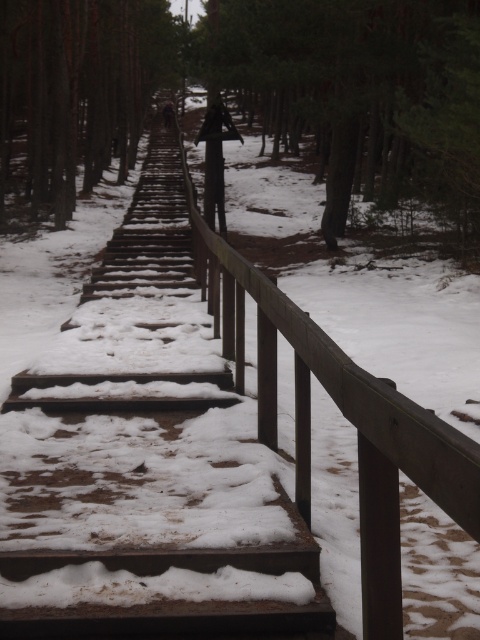
Question: Does wooden stairs at center have a greater width compared to brown wooden post at center?

Choices:
 (A) no
 (B) yes

Answer: (A)

Question: Does dark brown wood post at center have a larger size compared to dark brown wooden post at center?

Choices:
 (A) no
 (B) yes

Answer: (B)

Question: Which of these objects is positioned farthest from the wooden stairs at center?

Choices:
 (A) brown wooden post at center
 (B) dark brown wooden post at center

Answer: (A)

Question: Which is farther from the brown wooden post at center?

Choices:
 (A) dark brown wooden post at center
 (B) dark brown wood post at center
 (C) wooden stairs at center

Answer: (C)

Question: Which is nearer to the dark brown wooden post at center?

Choices:
 (A) brown wooden post at center
 (B) wooden stairs at center
 (C) dark brown wood post at center

Answer: (B)

Question: Does wooden stairs at center appear on the left side of brown wooden post at center?

Choices:
 (A) yes
 (B) no

Answer: (B)